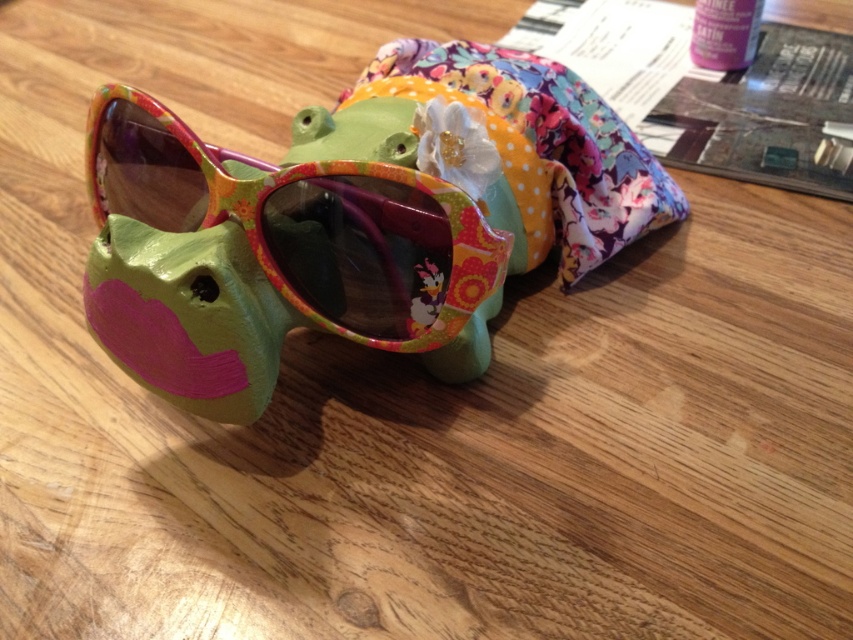
You are organizing a craft fair booth and need to place the matte plastic goggles at center and the floral fabric pouch at center on a shelf. Based on their positions in the image, which object should you place lower on the shelf to match the original arrangement?

The matte plastic goggles at center should be placed lower on the shelf because in the original arrangement, the matte plastic goggles at center is positioned under the floral fabric pouch at center.